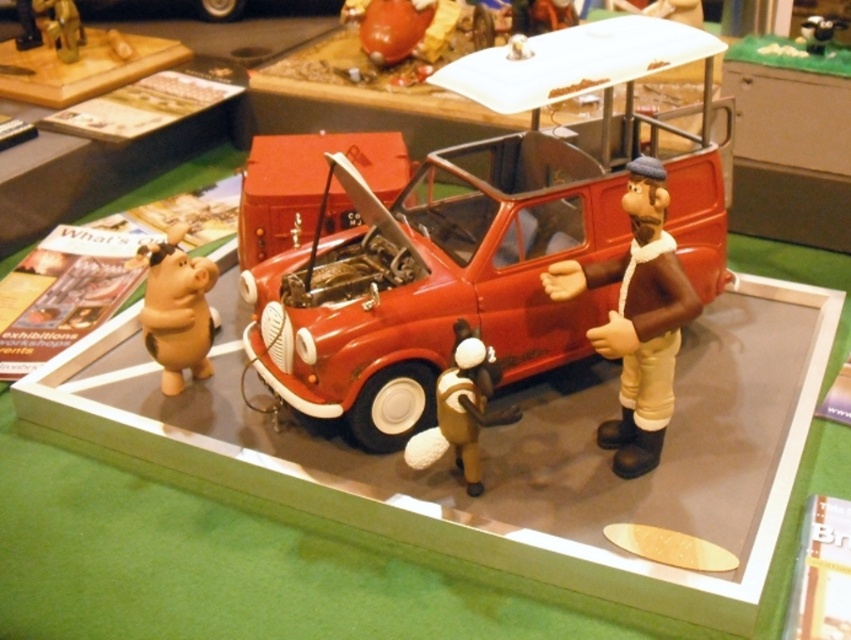
Is shiny red car at center shorter than brown matte figure at left?

No.

Who is higher up, shiny red car at center or brown matte figure at left?

shiny red car at center

This screenshot has width=851, height=640. What do you see at coordinates (433, 282) in the screenshot? I see `shiny red car at center` at bounding box center [433, 282].

Where is `shiny red car at center`? shiny red car at center is located at coordinates (433, 282).

Is the position of brown matte figure at left less distant than that of matte brown figure at center?

No, it is not.

Which is below, brown matte figure at left or matte brown figure at center?

Positioned lower is matte brown figure at center.

Which is in front, point (164, 372) or point (450, 442)?

Point (450, 442) is more forward.

Locate an element on the screen. Image resolution: width=851 pixels, height=640 pixels. brown matte figure at left is located at coordinates (176, 308).

Is point (329, 355) closer to viewer compared to point (471, 387)?

No, (329, 355) is behind (471, 387).

Who is positioned more to the left, shiny red car at center or matte brown figure at center?

Positioned to the left is matte brown figure at center.

The width and height of the screenshot is (851, 640). Describe the element at coordinates (433, 282) in the screenshot. I see `shiny red car at center` at that location.

Locate an element on the screen. shiny red car at center is located at coordinates (433, 282).